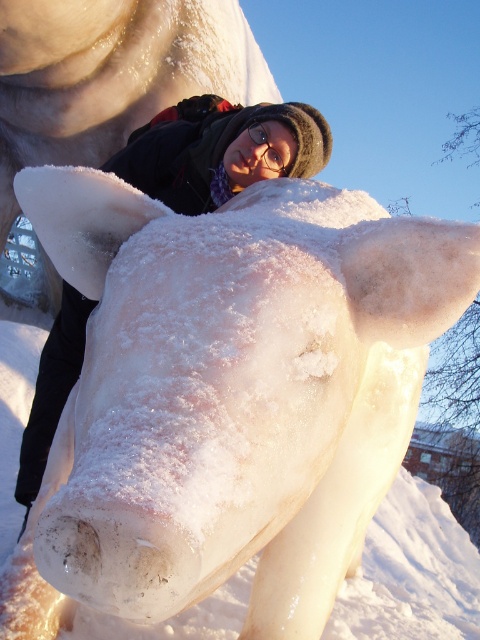
Question: Which point is farther from the camera taking this photo?

Choices:
 (A) (260, 129)
 (B) (99, 221)

Answer: (A)

Question: Is matte black jacket at center smaller than transparent plastic goggles at center?

Choices:
 (A) yes
 (B) no

Answer: (B)

Question: Does matte black jacket at center have a smaller size compared to transparent plastic goggles at center?

Choices:
 (A) yes
 (B) no

Answer: (B)

Question: Which object is positioned closest to the matte black jacket at center?

Choices:
 (A) transparent plastic goggles at center
 (B) icy white sculpture at center

Answer: (A)

Question: Can you confirm if icy white sculpture at center is positioned above matte black jacket at center?

Choices:
 (A) no
 (B) yes

Answer: (A)

Question: Based on their relative distances, which object is farther from the matte black jacket at center?

Choices:
 (A) icy white sculpture at center
 (B) transparent plastic goggles at center

Answer: (A)